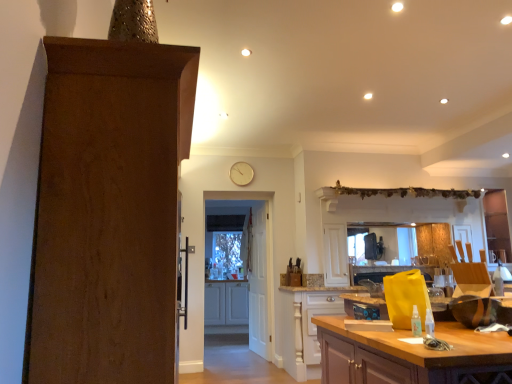
Question: Considering the relative positions of white wooden door at center, the third door positioned from the front, and gold metallic clock at upper center in the image provided, is white wooden door at center, the third door positioned from the front, to the left of gold metallic clock at upper center from the viewer's perspective?

Choices:
 (A) no
 (B) yes

Answer: (A)

Question: Is white wooden door at center, the 1th door in the back-to-front sequence, taller than gold metallic clock at upper center?

Choices:
 (A) yes
 (B) no

Answer: (A)

Question: Does white wooden door at center, the 1th door in the back-to-front sequence, have a larger size compared to gold metallic clock at upper center?

Choices:
 (A) yes
 (B) no

Answer: (A)

Question: From a real-world perspective, does white wooden door at center, the third door positioned from the front, sit lower than gold metallic clock at upper center?

Choices:
 (A) yes
 (B) no

Answer: (A)

Question: Is white wooden door at center, the third door positioned from the front, at the right side of gold metallic clock at upper center?

Choices:
 (A) yes
 (B) no

Answer: (A)

Question: From a real-world perspective, is gold metallic clock at upper center above or below brown wood door at left, the 1th door viewed from the front?

Choices:
 (A) below
 (B) above

Answer: (B)

Question: Considering the positions of gold metallic clock at upper center and brown wood door at left, the 1th door viewed from the front, in the image, is gold metallic clock at upper center taller or shorter than brown wood door at left, the 1th door viewed from the front,?

Choices:
 (A) short
 (B) tall

Answer: (A)

Question: From the image's perspective, relative to brown wood door at left, the third door when ordered from back to front, is gold metallic clock at upper center above or below?

Choices:
 (A) below
 (B) above

Answer: (B)

Question: Choose the correct answer: Is gold metallic clock at upper center inside brown wood door at left, the 1th door viewed from the front, or outside it?

Choices:
 (A) inside
 (B) outside

Answer: (B)

Question: Is point (256, 288) positioned closer to the camera than point (62, 64)?

Choices:
 (A) closer
 (B) farther

Answer: (B)

Question: Considering the positions of white wooden door at center, the second door viewed from the front, and brown wood door at left, the 1th door viewed from the front, in the image, is white wooden door at center, the second door viewed from the front, wider or thinner than brown wood door at left, the 1th door viewed from the front,?

Choices:
 (A) thin
 (B) wide

Answer: (A)

Question: From a real-world perspective, is white wooden door at center, the second door from the back, physically located above or below brown wood door at left, the 1th door viewed from the front?

Choices:
 (A) above
 (B) below

Answer: (B)

Question: In the image, is white wooden door at center, the second door from the back, positioned in front of or behind brown wood door at left, the 1th door viewed from the front?

Choices:
 (A) front
 (B) behind

Answer: (B)

Question: Is white wooden door at center, the second door viewed from the front, spatially inside wooden countertop at lower right, which is the first cabinetry in front-to-back order, or outside of it?

Choices:
 (A) inside
 (B) outside

Answer: (B)

Question: Does point (256, 296) appear closer or farther from the camera than point (407, 382)?

Choices:
 (A) closer
 (B) farther

Answer: (B)